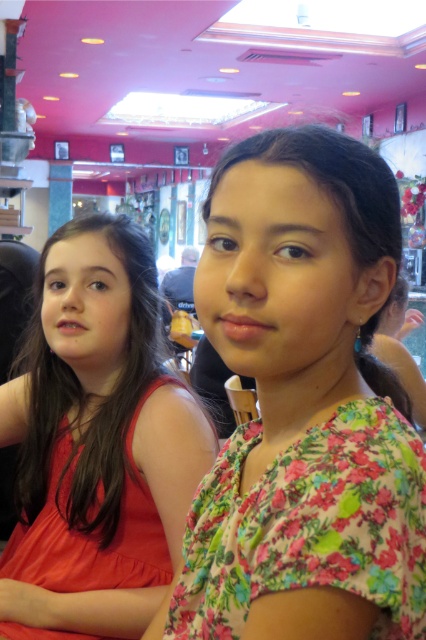
Question: Is floral fabric dress at center smaller than matte orange dress at center?

Choices:
 (A) no
 (B) yes

Answer: (B)

Question: Which of the following is the closest to the observer?

Choices:
 (A) floral fabric dress at center
 (B) matte orange dress at center

Answer: (A)

Question: Can you confirm if floral fabric dress at center is positioned below matte orange dress at center?

Choices:
 (A) yes
 (B) no

Answer: (B)

Question: Is floral fabric dress at center to the right of matte orange dress at center from the viewer's perspective?

Choices:
 (A) no
 (B) yes

Answer: (B)